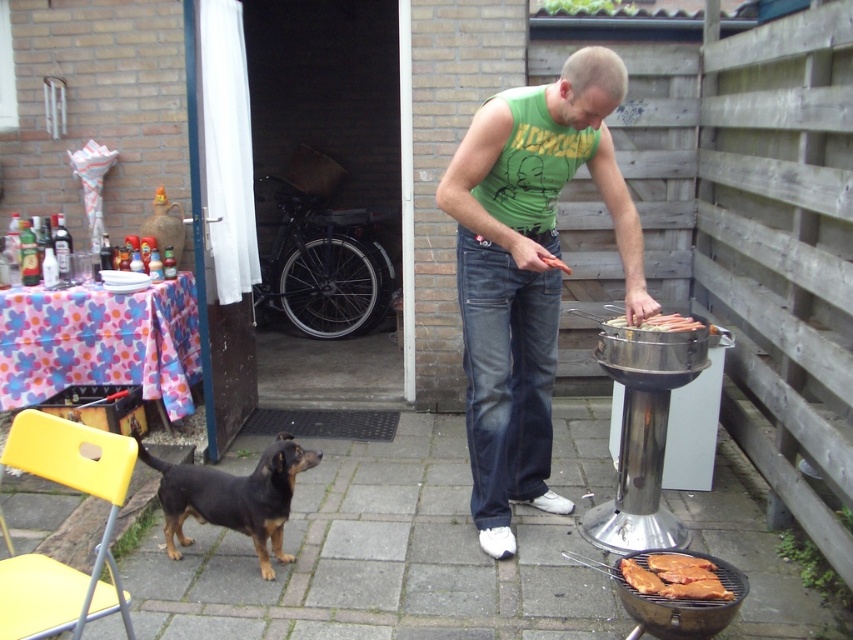
Question: Which of the following is the closest to the observer?

Choices:
 (A) (467, 404)
 (B) (294, 472)
 (C) (689, 563)

Answer: (C)

Question: Which point appears closest to the camera in this image?

Choices:
 (A) (653, 324)
 (B) (646, 566)
 (C) (311, 458)
 (D) (502, 234)

Answer: (B)

Question: Which of these objects is positioned closest to the green cotton tank top at center?

Choices:
 (A) yellow plastic chair at lower left
 (B) brown textured meat at lower center
 (C) smooth silver grill at right
 (D) brown/black fur dog at lower left

Answer: (C)

Question: In this image, where is yellow plastic chair at lower left located relative to brown textured meat at lower center?

Choices:
 (A) above
 (B) below

Answer: (A)

Question: Does green cotton tank top at center appear on the left side of smooth silver grill at right?

Choices:
 (A) yes
 (B) no

Answer: (A)

Question: Does green cotton tank top at center lie behind yellow plastic chair at lower left?

Choices:
 (A) yes
 (B) no

Answer: (A)